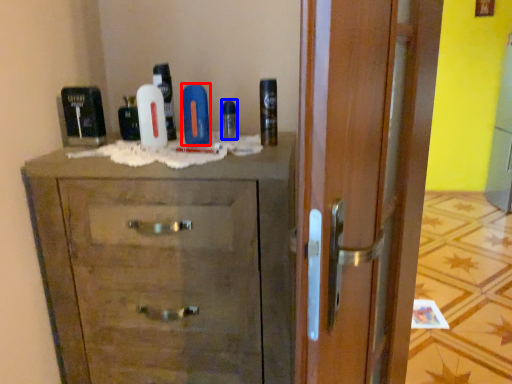
Question: Which point is further to the camera, toiletry (highlighted by a red box) or mouthwash (highlighted by a blue box)?

Choices:
 (A) toiletry
 (B) mouthwash

Answer: (B)